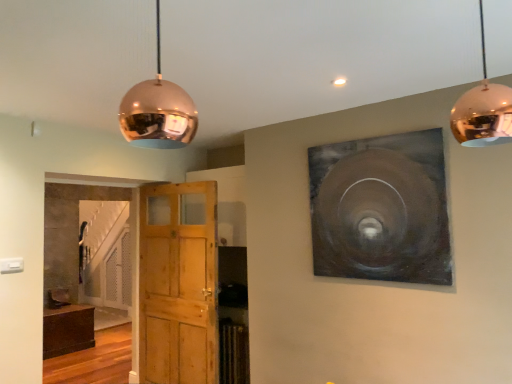
Question: Does metallic silver painting at upper right have a lesser height compared to copper reflective sphere at upper right, the 2th lamp in the left-to-right sequence?

Choices:
 (A) no
 (B) yes

Answer: (A)

Question: From a real-world perspective, is metallic silver painting at upper right below copper reflective sphere at upper right, which is the first lamp in right-to-left order?

Choices:
 (A) yes
 (B) no

Answer: (A)

Question: Can you confirm if metallic silver painting at upper right is positioned to the right of copper reflective sphere at upper right, the 2th lamp in the left-to-right sequence?

Choices:
 (A) no
 (B) yes

Answer: (B)

Question: Does metallic silver painting at upper right turn towards copper reflective sphere at upper right, the 2th lamp in the left-to-right sequence?

Choices:
 (A) no
 (B) yes

Answer: (B)

Question: Can we say metallic silver painting at upper right lies outside copper reflective sphere at upper right, the 2th lamp in the left-to-right sequence?

Choices:
 (A) no
 (B) yes

Answer: (B)

Question: Can you confirm if metallic silver painting at upper right is thinner than copper reflective sphere at upper right, the 2th lamp in the left-to-right sequence?

Choices:
 (A) no
 (B) yes

Answer: (B)

Question: Is copper reflective sphere at upper right, the 2th lamp in the left-to-right sequence, taller than wooden door at center?

Choices:
 (A) yes
 (B) no

Answer: (B)

Question: From the image's perspective, is copper reflective sphere at upper right, the 2th lamp in the left-to-right sequence, beneath wooden door at center?

Choices:
 (A) yes
 (B) no

Answer: (B)

Question: Is wooden door at center at the back of copper reflective sphere at upper right, the 2th lamp in the left-to-right sequence?

Choices:
 (A) no
 (B) yes

Answer: (A)

Question: From the image's perspective, is copper reflective sphere at upper right, the 2th lamp in the left-to-right sequence, located above wooden door at center?

Choices:
 (A) yes
 (B) no

Answer: (A)

Question: From a real-world perspective, is copper reflective sphere at upper right, which is the first lamp in right-to-left order, located beneath wooden door at center?

Choices:
 (A) yes
 (B) no

Answer: (B)

Question: Does copper reflective sphere at upper right, which is the first lamp in right-to-left order, contain wooden door at center?

Choices:
 (A) no
 (B) yes

Answer: (A)

Question: Is there a large distance between wooden door at center and copper reflective sphere at upper left, the second lamp viewed from the right?

Choices:
 (A) yes
 (B) no

Answer: (A)